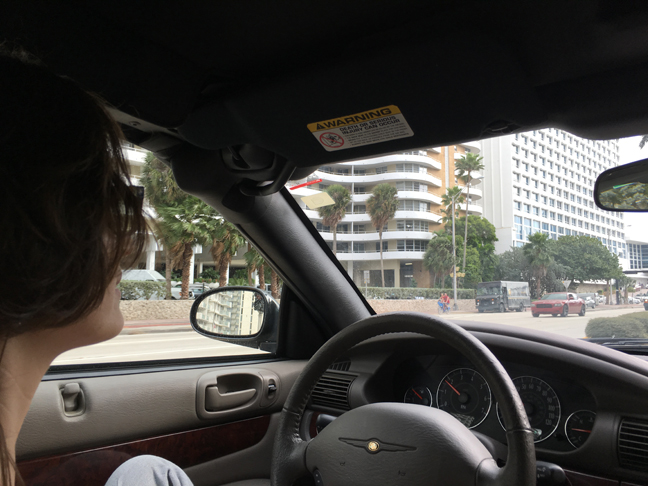
Where is `door handle`? This screenshot has height=486, width=648. door handle is located at coordinates (224, 402).